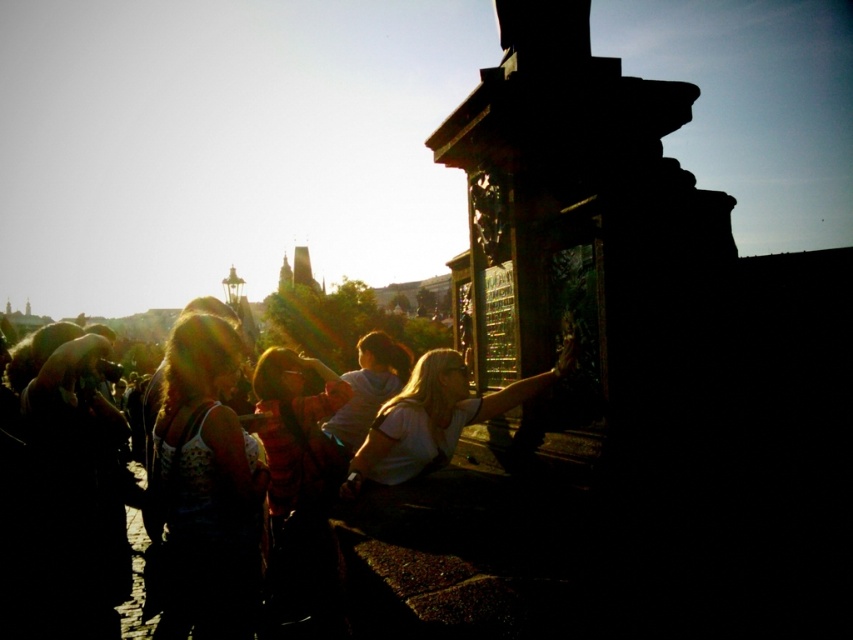
Question: Which is nearer to the white cotton shirt at center?

Choices:
 (A) white matte shirt at center
 (B) white textured tank top at center left

Answer: (B)

Question: Which of the following is the farthest from the observer?

Choices:
 (A) white textured tank top at center left
 (B) white cotton shirt at center

Answer: (A)

Question: Does white textured tank top at center left appear on the right side of white matte shirt at center?

Choices:
 (A) yes
 (B) no

Answer: (B)

Question: Which point is closer to the camera?

Choices:
 (A) white cotton shirt at center
 (B) white matte shirt at center
 (C) white textured tank top at center left

Answer: (A)

Question: Is white cotton shirt at center wider than white textured tank top at center left?

Choices:
 (A) no
 (B) yes

Answer: (B)

Question: Is white textured tank top at center left bigger than white matte shirt at center?

Choices:
 (A) yes
 (B) no

Answer: (A)